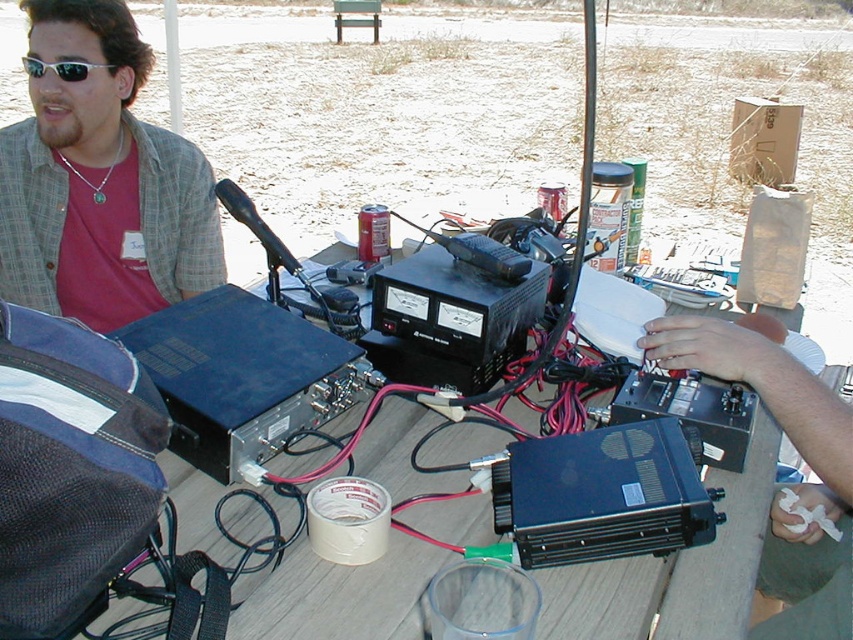
Question: Does matte black shirt at left have a greater width compared to wooden table at center?

Choices:
 (A) yes
 (B) no

Answer: (B)

Question: Is wooden table at center positioned behind silver metallic sunglasses at upper left?

Choices:
 (A) no
 (B) yes

Answer: (A)

Question: Considering the real-world distances, which object is farthest from the matte black shirt at left?

Choices:
 (A) silver metallic sunglasses at upper left
 (B) wooden table at center
 (C) black matte radio at center right

Answer: (C)

Question: Which object is positioned closest to the black matte radio at center right?

Choices:
 (A) silver metallic sunglasses at upper left
 (B) wooden table at center

Answer: (B)

Question: Based on their relative distances, which object is nearer to the black matte radio at center right?

Choices:
 (A) silver metallic sunglasses at upper left
 (B) matte black shirt at left

Answer: (B)

Question: Considering the relative positions of wooden table at center and silver metallic sunglasses at upper left in the image provided, where is wooden table at center located with respect to silver metallic sunglasses at upper left?

Choices:
 (A) right
 (B) left

Answer: (A)